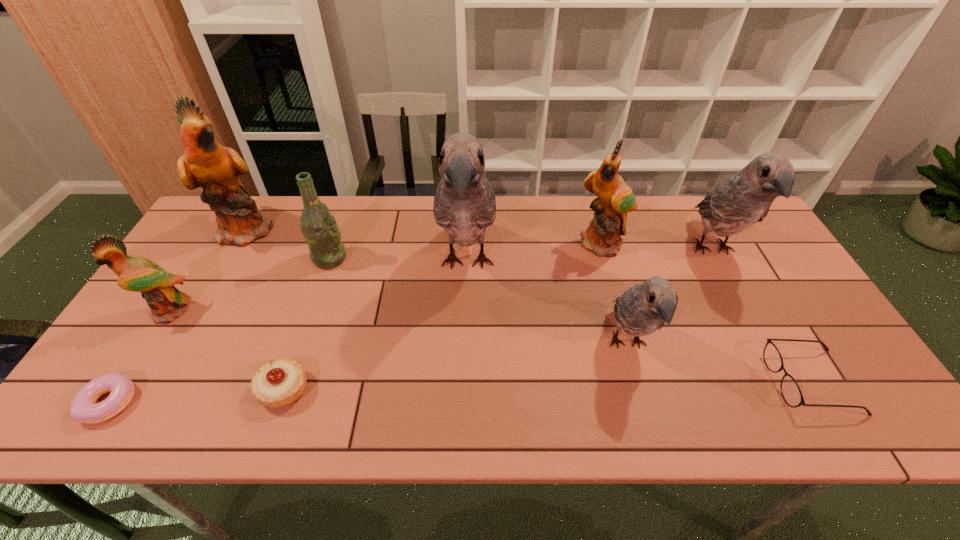
The width and height of the screenshot is (960, 540). In order to click on parrot that is at the right edge in this screenshot , I will do `click(741, 200)`.

Where is `spectacles located at the right edge`? spectacles located at the right edge is located at coordinates (790, 390).

At what (x,y) coordinates should I click in order to perform the action: click on object at the far left corner. Please return your answer as a coordinate pair (x, y). This screenshot has height=540, width=960. Looking at the image, I should click on (205, 163).

This screenshot has height=540, width=960. I want to click on object situated at the near left corner, so click(83, 408).

What are the coordinates of `object that is at the far right corner` in the screenshot? It's located at (741, 200).

Find the location of a particular element. object that is at the near right corner is located at coordinates (790, 390).

Where is `vacant space at the far edge`? The height and width of the screenshot is (540, 960). vacant space at the far edge is located at coordinates (500, 225).

I want to click on vacant space at the near edge of the desktop, so tap(636, 406).

Where is `free space at the left edge of the desktop`? The image size is (960, 540). free space at the left edge of the desktop is located at coordinates 155,366.

In the image, there is a desktop. Identify the location of free region at the right edge. (780, 318).